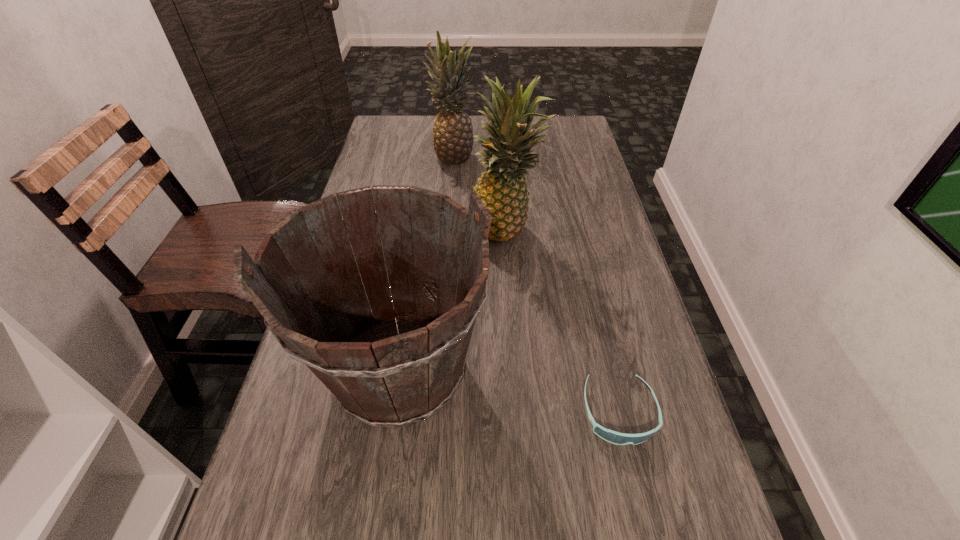
Identify the location of free space between the goggles and the bucket. This screenshot has width=960, height=540. pyautogui.click(x=509, y=392).

Point out which object is positioned as the fourth nearest to the bucket. Please provide its 2D coordinates. Your answer should be formatted as a tuple, i.e. [(x, y)], where the tuple contains the x and y coordinates of a point satisfying the conditions above.

[(453, 140)]

Identify the location of the fourth closest object relative to the nearer pineapple. This screenshot has width=960, height=540. (611, 436).